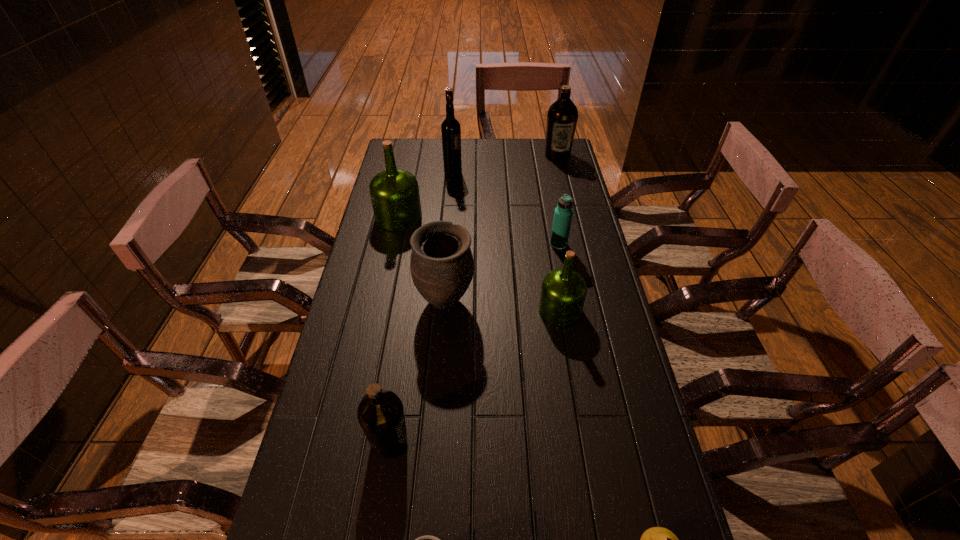
The width and height of the screenshot is (960, 540). In order to click on free point between the thermos bottle and the left green olive oil in this screenshot , I will do `click(479, 231)`.

Choose which object is the fifth nearest neighbor to the nearer green olive oil. Please provide its 2D coordinates. Your answer should be formatted as a tuple, i.e. [(x, y)], where the tuple contains the x and y coordinates of a point satisfying the conditions above.

[(656, 539)]

Identify the location of the seventh closest object to the pear. point(450,128).

Identify the location of olive oil that stands as the closest to the farthest object. (395, 197).

Point out which olive oil is positioned as the fourth nearest to the eighth tallest object. Please provide its 2D coordinates. Your answer should be formatted as a tuple, i.e. [(x, y)], where the tuple contains the x and y coordinates of a point satisfying the conditions above.

[(562, 116)]

In order to click on vacant space that satisfies the following two spatial constraints: 1. on the front and back of the wine bottle; 2. on the back side of the fourth farthest object in this screenshot , I will do `click(447, 245)`.

You are a GUI agent. You are given a task and a screenshot of the screen. Output one action in this format:
    pyautogui.click(x=<x>, y=<y>)
    Task: Click on the vacant space that satisfies the following two spatial constraints: 1. on the front and back of the urn; 2. on the left side of the wine bottle
    
    Given the screenshot: What is the action you would take?
    pyautogui.click(x=443, y=302)

Identify the location of free space that satisfies the following two spatial constraints: 1. on the label of the bigger brown olive oil; 2. on the front and back of the wine bottle. The image size is (960, 540). (562, 173).